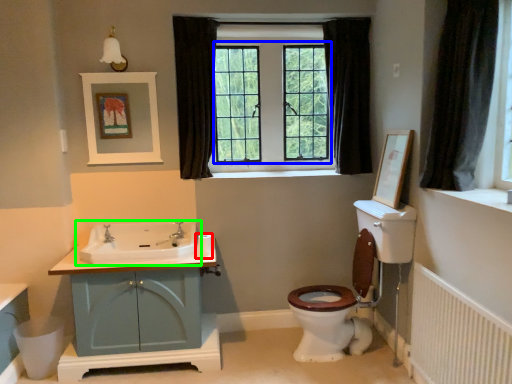
Question: Which is nearer to the toilet paper (highlighted by a red box)? bay window (highlighted by a blue box) or sink (highlighted by a green box).

Choices:
 (A) bay window
 (B) sink

Answer: (B)